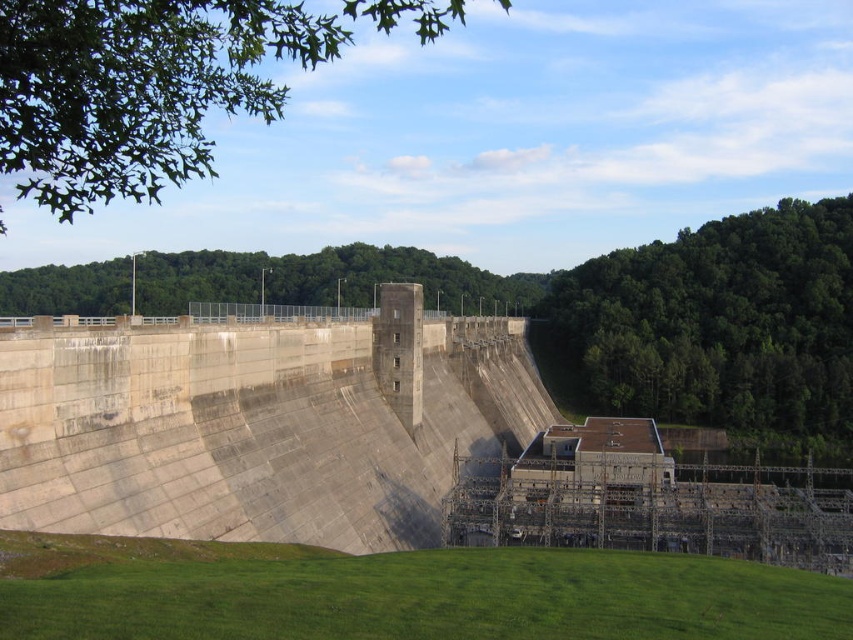
You are a hiker standing at the base of the dam and looking upward. You notice the green leafy tree at upper left and the green leafy trees at upper center. Which group of trees is positioned higher up in the scene?

The green leafy tree at upper left is positioned higher up in the scene than the green leafy trees at upper center.

You are a hiker standing at the base of the gray concrete dam at center and looking towards the green leafy trees at upper center. Which object appears taller from your perspective?

The green leafy trees at upper center appear taller than the gray concrete dam at center from your perspective.